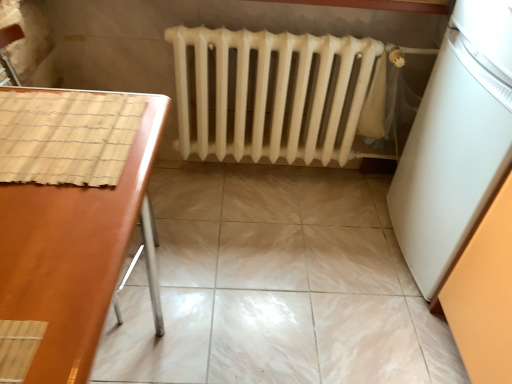
Question: From a real-world perspective, relative to white matte refrigerator at right, is brown glossy table at left vertically above or below?

Choices:
 (A) below
 (B) above

Answer: (A)

Question: Is point (106, 271) closer or farther from the camera than point (510, 8)?

Choices:
 (A) farther
 (B) closer

Answer: (B)

Question: Estimate the real-world distances between objects in this image. Which object is closer to the white matte radiator at center?

Choices:
 (A) marble tile floor at center
 (B) brown glossy table at left
 (C) white matte refrigerator at right

Answer: (A)

Question: Which object is the closest to the brown glossy table at left?

Choices:
 (A) white matte refrigerator at right
 (B) marble tile floor at center
 (C) white matte radiator at center

Answer: (C)